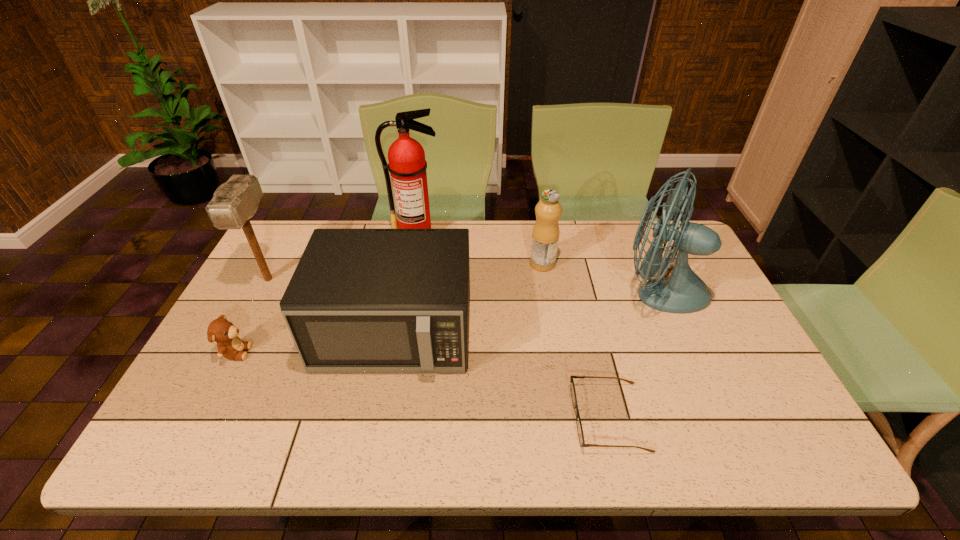
Find the location of a particular element. Image resolution: width=960 pixels, height=540 pixels. object located in the far right corner section of the desktop is located at coordinates (683, 292).

The image size is (960, 540). In order to click on vacant space at the far edge of the desktop in this screenshot , I will do `click(594, 234)`.

Where is `vacant space at the near edge of the desktop`? The width and height of the screenshot is (960, 540). vacant space at the near edge of the desktop is located at coordinates (659, 435).

The height and width of the screenshot is (540, 960). In order to click on vacant point at the left edge in this screenshot , I will do `click(249, 319)`.

At what (x,y) coordinates should I click in order to perform the action: click on vacant area between the fruit juice and the fire extinguisher. Please return your answer as a coordinate pair (x, y). The height and width of the screenshot is (540, 960). Looking at the image, I should click on (479, 248).

In order to click on unoccupied position between the shortest object and the fan in this screenshot , I will do `click(635, 354)`.

Locate an element on the screen. Image resolution: width=960 pixels, height=540 pixels. vacant area between the fire extinguisher and the spectacles is located at coordinates (513, 325).

Where is `vacant area that lies between the teddy bear and the fifth shortest object`? The width and height of the screenshot is (960, 540). vacant area that lies between the teddy bear and the fifth shortest object is located at coordinates (252, 316).

This screenshot has height=540, width=960. In order to click on empty space between the spectacles and the second shortest object in this screenshot , I will do `click(422, 384)`.

I want to click on free space between the sixth tallest object and the spectacles, so click(x=422, y=384).